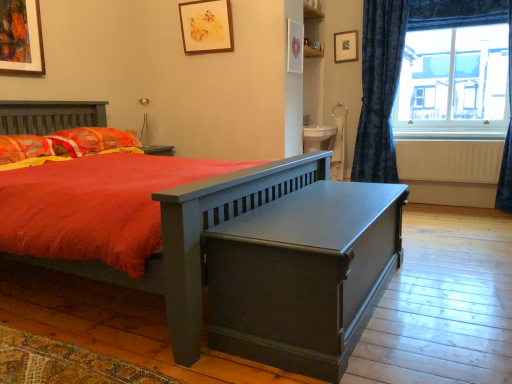
Question: Does white matte radiator at right have a lesser width compared to matte wooden picture frame at upper center, positioned as the fourth picture frame in left-to-right order?

Choices:
 (A) no
 (B) yes

Answer: (B)

Question: From a real-world perspective, is white matte radiator at right positioned under matte wooden picture frame at upper center, the 1th picture frame viewed from the back, based on gravity?

Choices:
 (A) no
 (B) yes

Answer: (B)

Question: Is white matte radiator at right completely or partially outside of matte wooden picture frame at upper center, the 1th picture frame viewed from the back?

Choices:
 (A) no
 (B) yes

Answer: (B)

Question: From the image's perspective, is white matte radiator at right on top of matte wooden picture frame at upper center, which appears as the 1th picture frame when viewed from the right?

Choices:
 (A) yes
 (B) no

Answer: (B)

Question: Considering the relative sizes of white matte radiator at right and matte wooden picture frame at upper center, which ranks as the 4th picture frame in front-to-back order, in the image provided, is white matte radiator at right wider than matte wooden picture frame at upper center, which ranks as the 4th picture frame in front-to-back order,?

Choices:
 (A) yes
 (B) no

Answer: (B)

Question: From the image's perspective, is matte wooden picture frame at upper center, the 1th picture frame viewed from the back, positioned above or below matte wooden picture frame at upper left, marked as the fourth picture frame in a back-to-front arrangement?

Choices:
 (A) below
 (B) above

Answer: (B)

Question: Is point (354, 31) positioned closer to the camera than point (40, 36)?

Choices:
 (A) farther
 (B) closer

Answer: (A)

Question: Considering the positions of matte wooden picture frame at upper center, positioned as the fourth picture frame in left-to-right order, and matte wooden picture frame at upper left, which is the 1th picture frame from left to right, in the image, is matte wooden picture frame at upper center, positioned as the fourth picture frame in left-to-right order, wider or thinner than matte wooden picture frame at upper left, which is the 1th picture frame from left to right,?

Choices:
 (A) wide
 (B) thin

Answer: (B)

Question: Is matte wooden picture frame at upper center, which ranks as the 4th picture frame in front-to-back order, taller or shorter than matte wooden picture frame at upper left, marked as the fourth picture frame in a back-to-front arrangement?

Choices:
 (A) short
 (B) tall

Answer: (A)

Question: From the image's perspective, relative to transparent glass window at upper right, is blue textured curtain at right, which is the 1th curtain from left to right, above or below?

Choices:
 (A) below
 (B) above

Answer: (A)

Question: From a real-world perspective, relative to transparent glass window at upper right, is blue textured curtain at right, which is the 2th curtain from right to left, vertically above or below?

Choices:
 (A) above
 (B) below

Answer: (B)

Question: Considering the positions of blue textured curtain at right, which is the 1th curtain from left to right, and transparent glass window at upper right in the image, is blue textured curtain at right, which is the 1th curtain from left to right, taller or shorter than transparent glass window at upper right?

Choices:
 (A) tall
 (B) short

Answer: (A)

Question: Considering their positions, is blue textured curtain at right, which is the 1th curtain from left to right, located in front of or behind transparent glass window at upper right?

Choices:
 (A) behind
 (B) front

Answer: (A)

Question: Based on their sizes in the image, would you say matte wooden picture frame at upper center, which appears as the 1th picture frame when viewed from the right, is bigger or smaller than fluffy orange pillow at left, which ranks as the first pillow in front-to-back order?

Choices:
 (A) small
 (B) big

Answer: (A)

Question: Considering the positions of matte wooden picture frame at upper center, the 1th picture frame viewed from the back, and fluffy orange pillow at left, which ranks as the first pillow in front-to-back order, in the image, is matte wooden picture frame at upper center, the 1th picture frame viewed from the back, taller or shorter than fluffy orange pillow at left, which ranks as the first pillow in front-to-back order,?

Choices:
 (A) short
 (B) tall

Answer: (B)